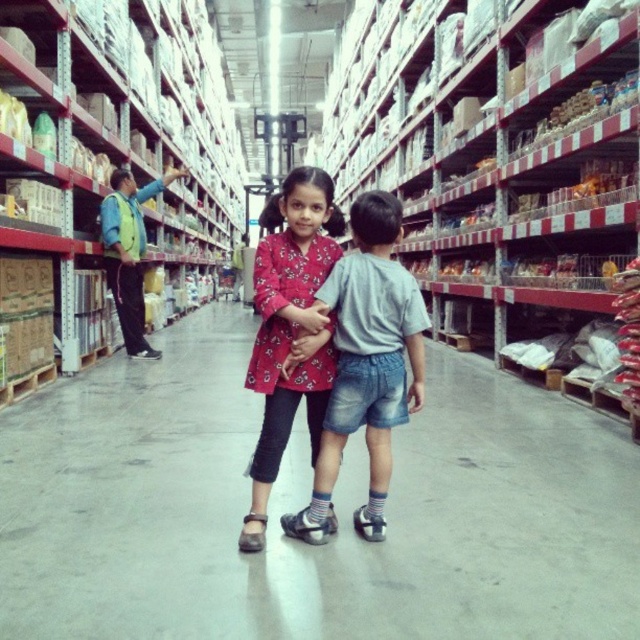
Question: Which point appears closest to the camera in this image?

Choices:
 (A) pyautogui.click(x=294, y=240)
 (B) pyautogui.click(x=116, y=205)

Answer: (A)

Question: Observing the image, what is the correct spatial positioning of metallic silver shelves at center in reference to matte cardboard boxes at left?

Choices:
 (A) right
 (B) left

Answer: (A)

Question: Estimate the real-world distances between objects in this image. Which object is farther from the matte cardboard boxes at left?

Choices:
 (A) metallic silver shelves at center
 (B) matte floral shirt at center

Answer: (A)

Question: Which point is farther to the camera?

Choices:
 (A) matte cardboard boxes at left
 (B) metallic silver shelves at center
 (C) matte floral shirt at center
 (D) matte pink dress at center

Answer: (A)

Question: In this image, where is metallic silver shelves at center located relative to denim shorts at center?

Choices:
 (A) left
 (B) right

Answer: (B)

Question: Can you confirm if matte pink dress at center is positioned to the right of matte floral shirt at center?

Choices:
 (A) yes
 (B) no

Answer: (A)